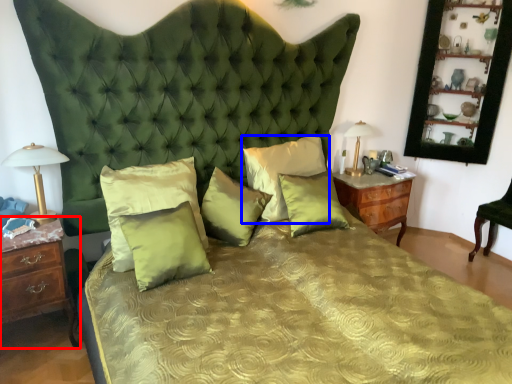
Question: Which of the following is the farthest to the observer, nightstand (highlighted by a red box) or pillow (highlighted by a blue box)?

Choices:
 (A) nightstand
 (B) pillow

Answer: (B)